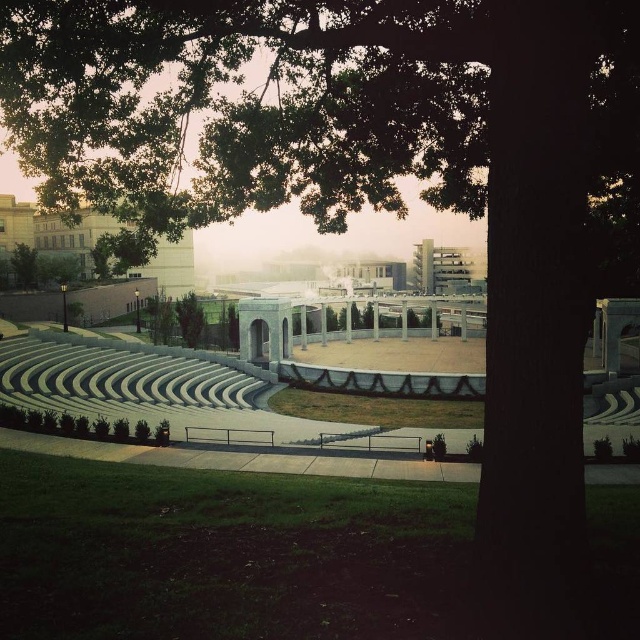
Find the location of `white marble amphitheater at upper left`. white marble amphitheater at upper left is located at coordinates (52, 230).

Which is more to the left, white marble amphitheater at upper left or green leafy tree at left?

green leafy tree at left

From the picture: Who is more distant from viewer, (90,237) or (17,272)?

Point (90,237)

Locate an element on the screen. The width and height of the screenshot is (640, 640). white marble amphitheater at upper left is located at coordinates (52, 230).